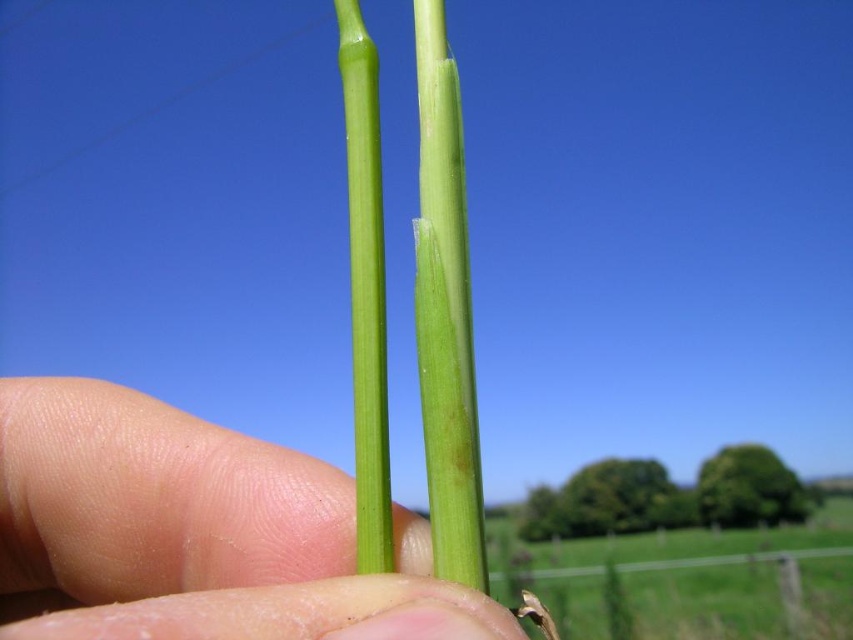
Question: Can you confirm if smooth skin at center is thinner than green smooth grass at center?

Choices:
 (A) no
 (B) yes

Answer: (B)

Question: Which of the following is the closest to the observer?

Choices:
 (A) (264, 602)
 (B) (379, 372)

Answer: (A)

Question: Can you confirm if smooth skin at center is positioned to the right of green smooth grass at center?

Choices:
 (A) no
 (B) yes

Answer: (A)

Question: Which object is the farthest from the green smooth stem at center?

Choices:
 (A) smooth skin at center
 (B) green smooth grass at center

Answer: (B)

Question: Which point is farther to the camera?

Choices:
 (A) green smooth grass at center
 (B) green smooth stem at center
 (C) smooth skin at center

Answer: (A)

Question: Is green smooth grass at center below green smooth stem at center?

Choices:
 (A) no
 (B) yes

Answer: (B)